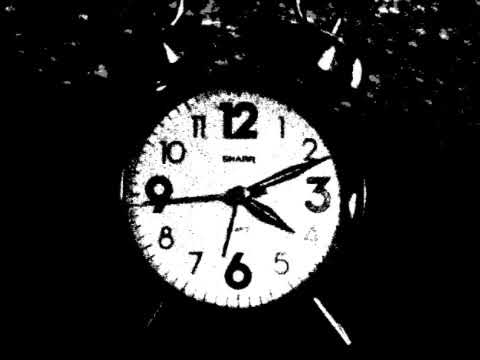
Identify the location of brand of clock. (245, 158).